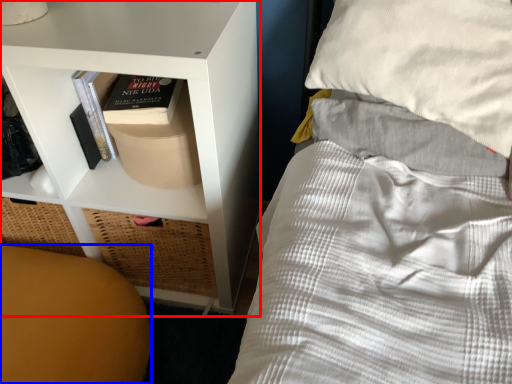
Question: Which point is further to the camera, shelf (highlighted by a red box) or furniture (highlighted by a blue box)?

Choices:
 (A) shelf
 (B) furniture

Answer: (B)